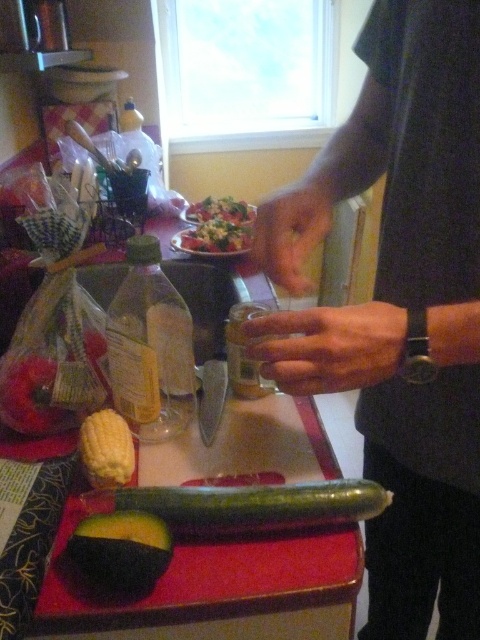
You are standing in the kitchen and want to reach the black fabric shirt at center. Based on the coordinates provided, is the shirt located closer to the top or bottom half of the image?

The black fabric shirt at center is located at coordinates point (x=400, y=307). Since the y coordinate is 0.835, which is above 0.5, the shirt is closer to the top half of the image.

You are trying to organize the items on the counter. You need to place the green matte avocado at lower left and the yellow matte corn at lower left into a drawer that can only hold items shorter than the corn. Will both items fit?

The green matte avocado at lower left is not as tall as the yellow matte corn at lower left. Since the drawer can hold items shorter than the corn, the avocado will fit, but the corn itself may not fit because the drawer requires items to be shorter than it. Therefore, only the avocado can be placed in the drawer.

You are organizing the items on the kitchen counter. The yellow matte corn at lower left and the shiny green salad at center are both in your way. Which one is taller?

The shiny green salad at center is taller than the yellow matte corn at lower left.